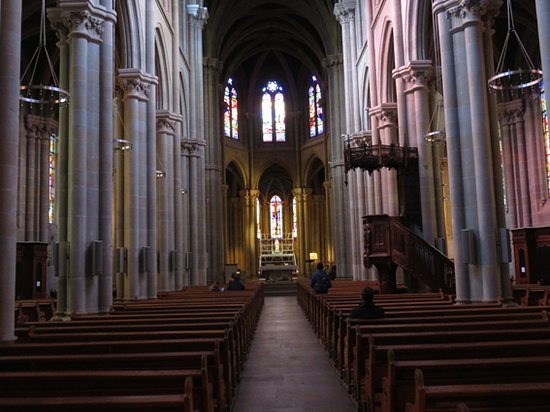
Locate an element on the screen. crucifix is located at coordinates (277, 205).